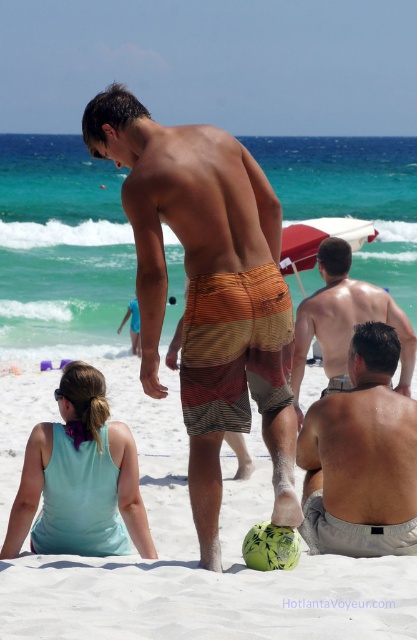
Question: Can you confirm if green textured ball at center is bigger than light blue fabric dress at lower left?

Choices:
 (A) no
 (B) yes

Answer: (B)

Question: Is smooth tan skin at lower right below light blue fabric dress at lower left?

Choices:
 (A) no
 (B) yes

Answer: (A)

Question: Which object appears farthest from the camera in this image?

Choices:
 (A) smooth tan skin at center
 (B) green textured ball at center
 (C) striped cotton shorts at center
 (D) light blue fabric dress at lower left

Answer: (A)

Question: Which point is farther to the camera?

Choices:
 (A) (92, 429)
 (B) (231, 452)
 (C) (394, 486)

Answer: (B)

Question: Is striped cotton shorts at center positioned at the back of smooth tan skin at center?

Choices:
 (A) no
 (B) yes

Answer: (A)

Question: Which point appears farthest from the camera in this image?

Choices:
 (A) (215, 320)
 (B) (115, 476)

Answer: (B)